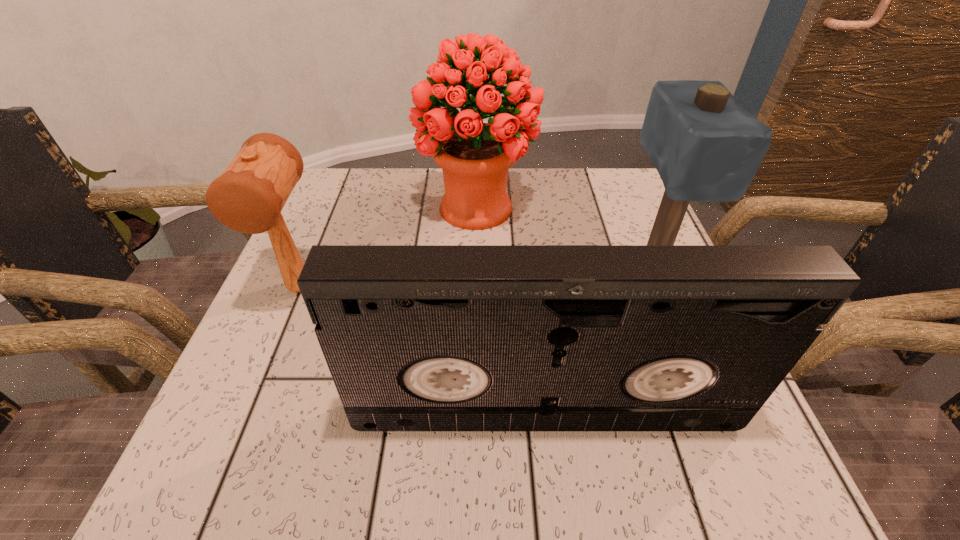
Where is `object present at the near edge`? object present at the near edge is located at coordinates (416, 337).

Locate an element on the screen. object at the left edge is located at coordinates (248, 197).

The width and height of the screenshot is (960, 540). I want to click on mallet that is at the right edge, so point(705,146).

Where is `videotape located at the right edge`? videotape located at the right edge is located at coordinates (416, 337).

Where is `object that is at the near right corner`? object that is at the near right corner is located at coordinates (416, 337).

At what (x,y) coordinates should I click in order to perform the action: click on blank space at the far edge. Please return your answer as a coordinate pair (x, y). Looking at the image, I should click on (553, 215).

The height and width of the screenshot is (540, 960). Find the location of `free region at the near edge`. free region at the near edge is located at coordinates (472, 443).

The width and height of the screenshot is (960, 540). Find the location of `vacant space at the left edge`. vacant space at the left edge is located at coordinates (252, 386).

In the image, there is a desktop. Where is `blank space at the far left corner`? This screenshot has height=540, width=960. blank space at the far left corner is located at coordinates (368, 171).

In the image, there is a desktop. Where is `vacant space at the far right corner`? vacant space at the far right corner is located at coordinates (586, 183).